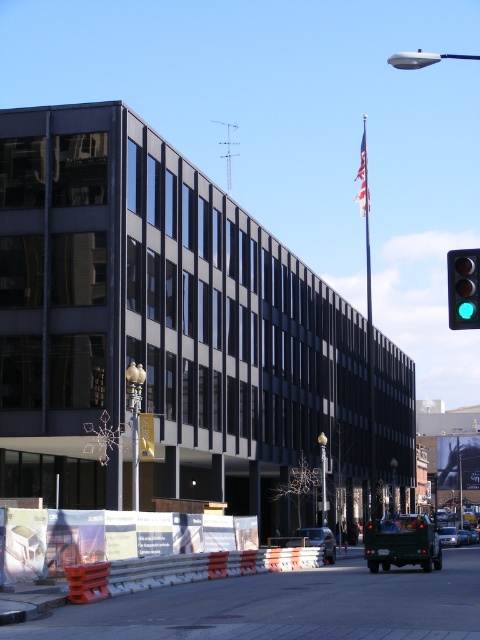
You are a pedestrian standing at the crosswalk facing the modern multi story building with dark facade. You see a shiny silver sedan at center and a silver metallic sedan at center. Which one is more to the left?

The shiny silver sedan at center is more to the left side of silver metallic sedan at center.